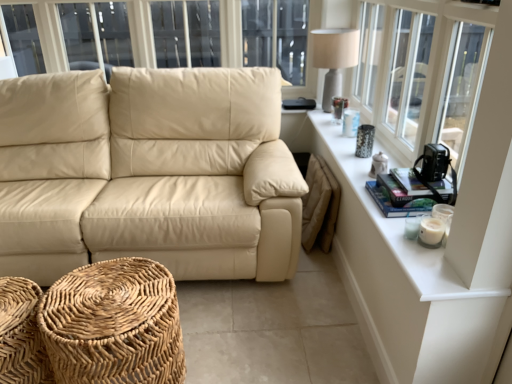
Question: Is woven natural fiber footrest at lower left, the 2th footrest from the left, aimed at woven wood footrest at lower left, marked as the second footrest in a right-to-left arrangement?

Choices:
 (A) no
 (B) yes

Answer: (A)

Question: Is woven natural fiber footrest at lower left, the 2th footrest from the left, in contact with woven wood footrest at lower left, positioned as the first footrest in left-to-right order?

Choices:
 (A) yes
 (B) no

Answer: (B)

Question: Considering the relative sizes of woven natural fiber footrest at lower left, the 2th footrest from the left, and woven wood footrest at lower left, positioned as the first footrest in left-to-right order, in the image provided, is woven natural fiber footrest at lower left, the 2th footrest from the left, smaller than woven wood footrest at lower left, positioned as the first footrest in left-to-right order,?

Choices:
 (A) no
 (B) yes

Answer: (A)

Question: Would you say woven natural fiber footrest at lower left, the 2th footrest from the left, is a long distance from woven wood footrest at lower left, marked as the second footrest in a right-to-left arrangement?

Choices:
 (A) yes
 (B) no

Answer: (B)

Question: Considering the relative sizes of woven natural fiber footrest at lower left, the 2th footrest from the left, and woven wood footrest at lower left, marked as the second footrest in a right-to-left arrangement, in the image provided, is woven natural fiber footrest at lower left, the 2th footrest from the left, bigger than woven wood footrest at lower left, marked as the second footrest in a right-to-left arrangement,?

Choices:
 (A) yes
 (B) no

Answer: (A)

Question: Can you confirm if woven natural fiber footrest at lower left, arranged as the first footrest when viewed from the right, is shorter than woven wood footrest at lower left, positioned as the first footrest in left-to-right order?

Choices:
 (A) no
 (B) yes

Answer: (A)

Question: From the image's perspective, is matte gray table lamp at upper right on top of woven wood footrest at lower left, marked as the second footrest in a right-to-left arrangement?

Choices:
 (A) no
 (B) yes

Answer: (B)

Question: Is matte gray table lamp at upper right positioned far away from woven wood footrest at lower left, marked as the second footrest in a right-to-left arrangement?

Choices:
 (A) no
 (B) yes

Answer: (B)

Question: Is matte gray table lamp at upper right wider than woven wood footrest at lower left, marked as the second footrest in a right-to-left arrangement?

Choices:
 (A) no
 (B) yes

Answer: (A)

Question: Is matte gray table lamp at upper right facing away from woven wood footrest at lower left, positioned as the first footrest in left-to-right order?

Choices:
 (A) yes
 (B) no

Answer: (B)

Question: From a real-world perspective, is matte gray table lamp at upper right below woven wood footrest at lower left, marked as the second footrest in a right-to-left arrangement?

Choices:
 (A) no
 (B) yes

Answer: (A)

Question: Would you say matte gray table lamp at upper right is outside woven wood footrest at lower left, marked as the second footrest in a right-to-left arrangement?

Choices:
 (A) yes
 (B) no

Answer: (A)

Question: Considering the relative sizes of woven natural fiber footrest at lower left, arranged as the first footrest when viewed from the right, and white ceramic table at upper right in the image provided, is woven natural fiber footrest at lower left, arranged as the first footrest when viewed from the right, bigger than white ceramic table at upper right?

Choices:
 (A) no
 (B) yes

Answer: (B)